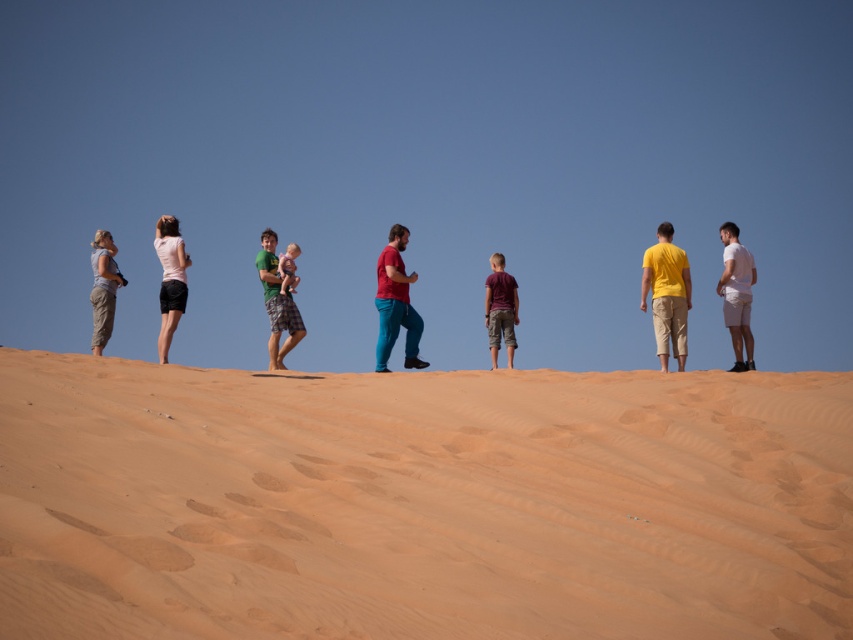
In order to click on green plaid shorts at center in this screenshot , I will do `click(276, 301)`.

From the picture: Is green plaid shorts at center wider than white cotton shorts at right?

Indeed, green plaid shorts at center has a greater width compared to white cotton shorts at right.

Measure the distance between point (286, 320) and camera.

Point (286, 320) is 85.50 feet from camera.

Locate an element on the screen. This screenshot has height=640, width=853. green plaid shorts at center is located at coordinates (276, 301).

Which is more to the right, yellow matte shorts at right or matte red pants at center?

Positioned to the right is yellow matte shorts at right.

Can you confirm if yellow matte shorts at right is wider than matte red pants at center?

No.

Locate an element on the screen. yellow matte shorts at right is located at coordinates (666, 292).

Who is shorter, matte pink shirt at left or matte green shirt at center?

matte green shirt at center is shorter.

Who is higher up, matte pink shirt at left or matte green shirt at center?

matte green shirt at center is higher up.

The height and width of the screenshot is (640, 853). What are the coordinates of `matte pink shirt at left` in the screenshot? It's located at (170, 280).